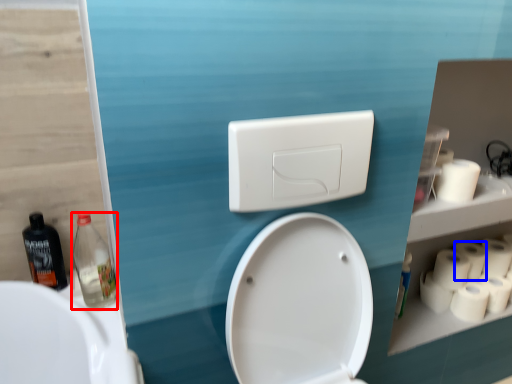
Question: Which object is closer to the camera taking this photo, bottle (highlighted by a red box) or toilet paper (highlighted by a blue box)?

Choices:
 (A) bottle
 (B) toilet paper

Answer: (A)